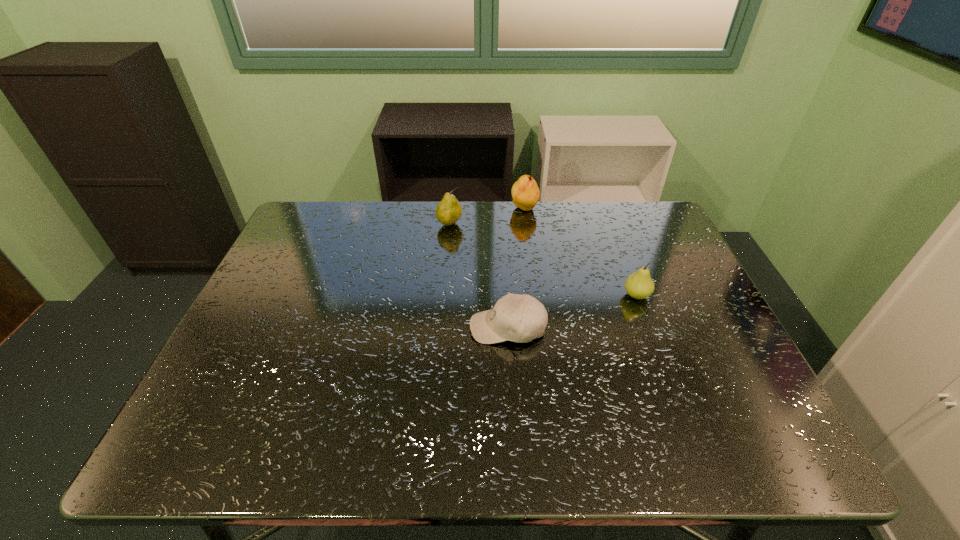
Identify the location of the second pear from right to left. (525, 193).

Find the location of `the farthest object`. the farthest object is located at coordinates (525, 193).

Find the location of a particular element. This screenshot has height=540, width=960. the second farthest object is located at coordinates (448, 211).

The width and height of the screenshot is (960, 540). Identify the location of the second farthest pear. (448, 211).

What are the coordinates of `the rightmost object` in the screenshot? It's located at (639, 285).

Where is `the nearest pear`? This screenshot has height=540, width=960. the nearest pear is located at coordinates (639, 285).

The width and height of the screenshot is (960, 540). Identify the location of baseball cap. (519, 318).

Where is `the shortest object`? The height and width of the screenshot is (540, 960). the shortest object is located at coordinates (519, 318).

Locate an element on the screen. This screenshot has width=960, height=540. free space located on the front of the farthest object is located at coordinates (533, 274).

You are a GUI agent. You are given a task and a screenshot of the screen. Output one action in this format:
    pyautogui.click(x=<x>, y=<y>)
    Task: Click on the vacant space located on the front of the second farthest object
    Image resolution: width=960 pixels, height=540 pixels.
    Given the screenshot: What is the action you would take?
    pyautogui.click(x=447, y=248)